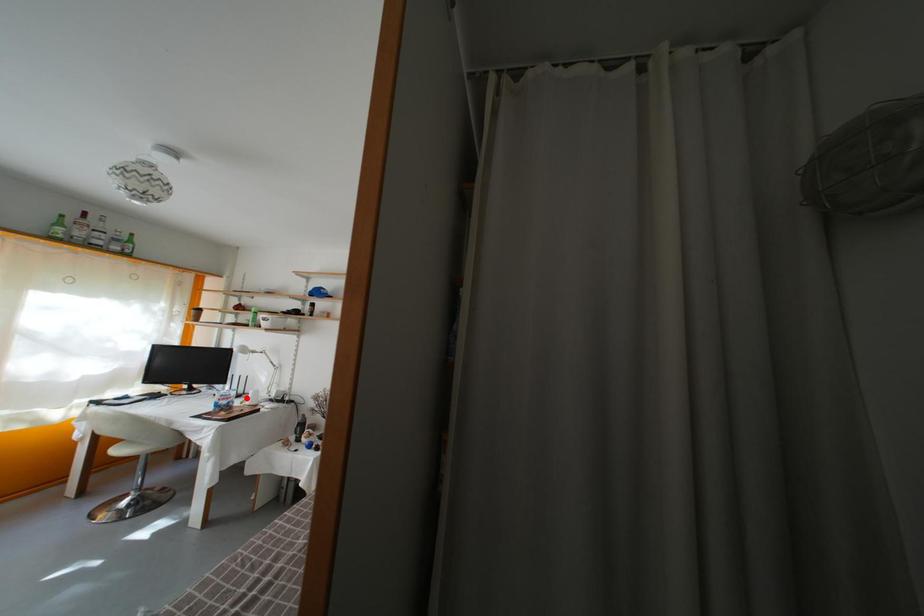
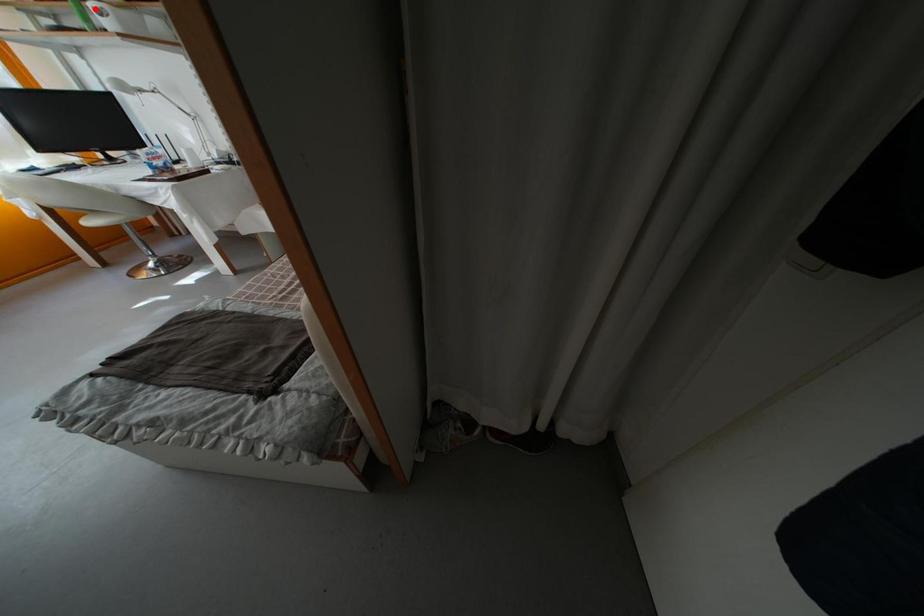
I am providing you with two images of the same scene from different viewpoints. A red point is marked on the first image and another point is marked on the second image. Do the highlighted points in image1 and image2 indicate the same real-world spot?

No